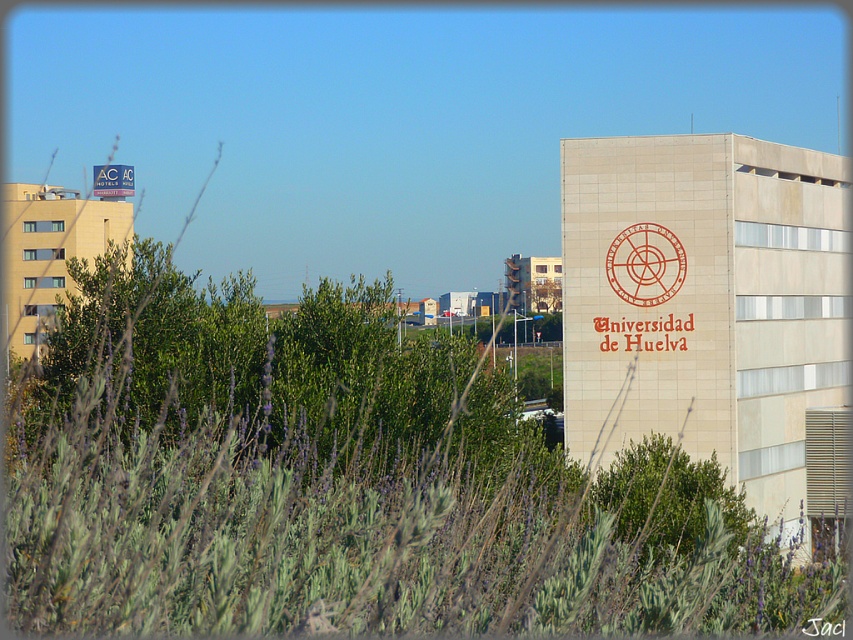
Question: Is red rubber stamp at upper center to the left of matte red sign at upper left from the viewer's perspective?

Choices:
 (A) yes
 (B) no

Answer: (B)

Question: Is green leafy tree at center thinner than matte red sign at upper left?

Choices:
 (A) yes
 (B) no

Answer: (A)

Question: Estimate the real-world distances between objects in this image. Which object is farther from the red rubber stamp at upper center?

Choices:
 (A) matte red sign at upper left
 (B) green leafy tree at center

Answer: (A)

Question: Can you confirm if red rubber stamp at upper center is positioned to the left of matte red sign at upper left?

Choices:
 (A) no
 (B) yes

Answer: (A)

Question: Which point is farther to the camera?

Choices:
 (A) (656, 301)
 (B) (645, 513)

Answer: (A)

Question: Which of the following is the farthest from the observer?

Choices:
 (A) green leafy tree at center
 (B) red rubber stamp at upper center

Answer: (B)